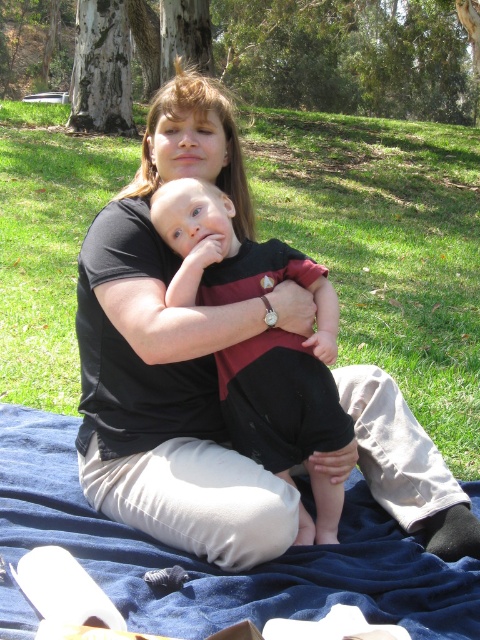
Does point (214, 625) come farther from viewer compared to point (237, 252)?

That is False.

Who is more distant from viewer, (0, 413) or (228, 419)?

The point (0, 413) is more distant.

You are a GUI agent. You are given a task and a screenshot of the screen. Output one action in this format:
    pyautogui.click(x=<x>, y=<y>)
    Task: Click on the blue fabric blanket at lower center
    Image resolution: width=480 pixels, height=640 pixels.
    Given the screenshot: What is the action you would take?
    pyautogui.click(x=217, y=568)

Is green grass at center closer to the viewer compared to blue fabric blanket at lower center?

No, it is not.

At what (x,y) coordinates should I click in order to perform the action: click on green grass at center. Please return your answer as a coordinate pair (x, y). Looking at the image, I should click on (385, 248).

Locate an element on the screen. This screenshot has width=480, height=640. green grass at center is located at coordinates (385, 248).

Between point (48, 228) and point (334, 381), which one is positioned in front?

Point (334, 381) is more forward.

Image resolution: width=480 pixels, height=640 pixels. What do you see at coordinates (385, 248) in the screenshot?
I see `green grass at center` at bounding box center [385, 248].

Where is `green grass at center`? The height and width of the screenshot is (640, 480). green grass at center is located at coordinates (385, 248).